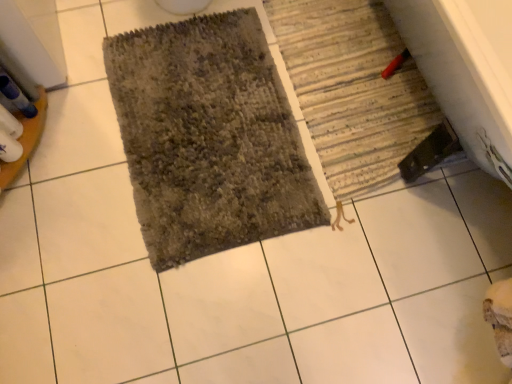
The height and width of the screenshot is (384, 512). In order to click on free point to the left of striped fabric bath mat at lower right, the second bath mat viewed from the left in this screenshot , I will do `click(199, 97)`.